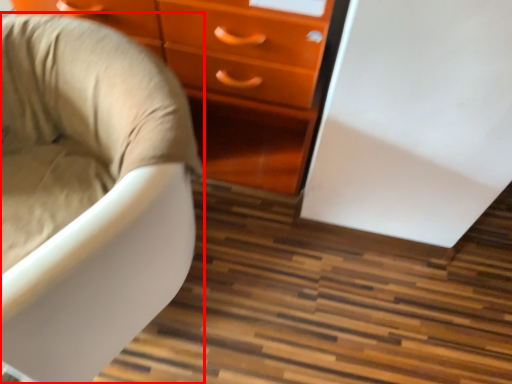
Question: From the image's perspective, what is the correct spatial positioning of chair (annotated by the red box) in reference to chest of drawers?

Choices:
 (A) below
 (B) above

Answer: (A)